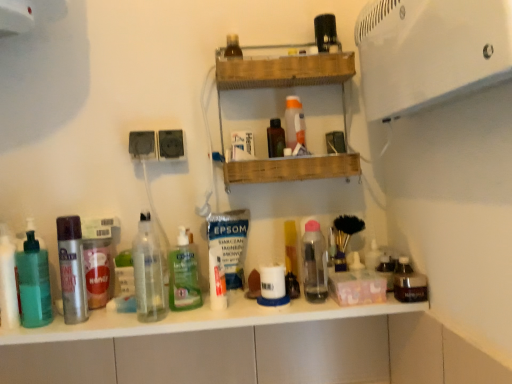
This screenshot has height=384, width=512. Find the location of `vacant space that is to the left of clear glass bottle at center, the 3th bottle from the left`. vacant space that is to the left of clear glass bottle at center, the 3th bottle from the left is located at coordinates (95, 326).